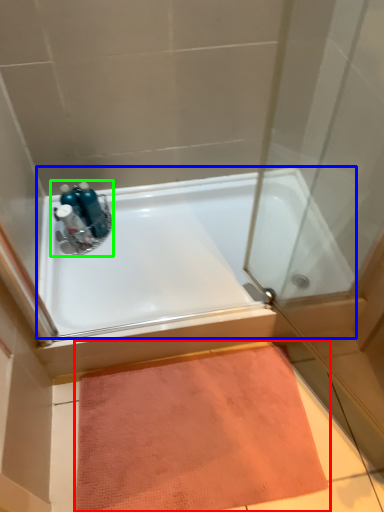
Question: Which is farther away from doormat (highlighted by a red box)? bathtub (highlighted by a blue box) or sink (highlighted by a green box)?

Choices:
 (A) bathtub
 (B) sink

Answer: (B)